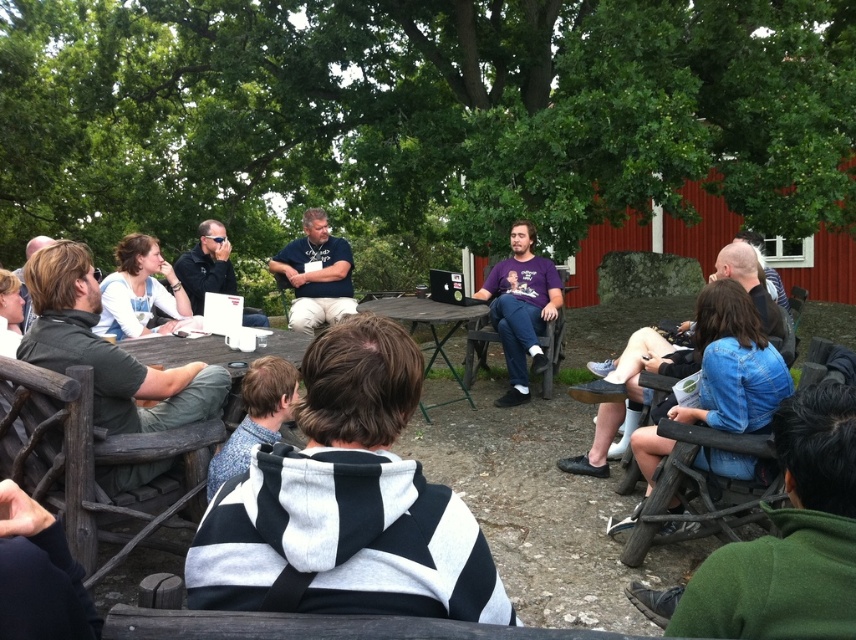
You are organizing a small event and need to ensure that the black and white striped hoodie at center can be placed on the wooden picnic table at center without hanging off the edges. Based on their sizes, is this possible?

The black and white striped hoodie at center has a width less than the wooden picnic table at center, so it can be placed on the table without hanging off the edges.

You are a photographer positioned at the back of the gathering. You want to capture a photo of both the purple cotton shirt at center and the white shirt at center. However, you notice that one of them is blocking the other. Which shirt is blocking the view of the other?

The white shirt at center is behind the purple cotton shirt at center, so the purple cotton shirt at center is blocking the view of the white shirt at center.